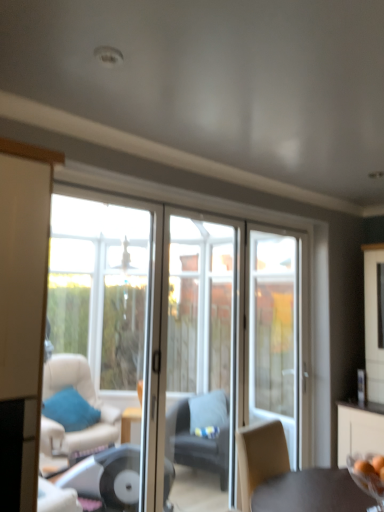
Question: Is the position of white glass door at center more distant than that of blue fabric pillow at lower left?

Choices:
 (A) no
 (B) yes

Answer: (A)

Question: Is white glass door at center to the left of blue fabric pillow at lower left from the viewer's perspective?

Choices:
 (A) no
 (B) yes

Answer: (A)

Question: From the image's perspective, is white glass door at center beneath blue fabric pillow at lower left?

Choices:
 (A) no
 (B) yes

Answer: (A)

Question: Considering the relative sizes of white glass door at center and blue fabric pillow at lower left in the image provided, is white glass door at center wider than blue fabric pillow at lower left?

Choices:
 (A) no
 (B) yes

Answer: (A)

Question: Considering the relative positions of white glass door at center and blue fabric pillow at lower left in the image provided, is white glass door at center to the right of blue fabric pillow at lower left from the viewer's perspective?

Choices:
 (A) no
 (B) yes

Answer: (B)

Question: Does point (367, 456) appear closer or farther from the camera than point (142, 357)?

Choices:
 (A) closer
 (B) farther

Answer: (B)

Question: Based on their positions, is transparent glass bowl at lower right located to the left or right of transparent glass window at left?

Choices:
 (A) left
 (B) right

Answer: (B)

Question: Considering their positions, is transparent glass bowl at lower right located in front of or behind transparent glass window at left?

Choices:
 (A) behind
 (B) front

Answer: (B)

Question: From a real-world perspective, is transparent glass bowl at lower right above or below transparent glass window at left?

Choices:
 (A) below
 (B) above

Answer: (A)

Question: Is transparent glass window at left wider or thinner than clear glass door at center, the second screen door in the left-to-right sequence?

Choices:
 (A) thin
 (B) wide

Answer: (A)

Question: In the image, is transparent glass window at left on the left side or the right side of clear glass door at center, which is the first screen door in right-to-left order?

Choices:
 (A) left
 (B) right

Answer: (A)

Question: Is point (77, 333) positioned closer to the camera than point (264, 378)?

Choices:
 (A) closer
 (B) farther

Answer: (B)

Question: Considering the positions of transparent glass window at left and clear glass door at center, the second screen door in the left-to-right sequence, in the image, is transparent glass window at left taller or shorter than clear glass door at center, the second screen door in the left-to-right sequence,?

Choices:
 (A) tall
 (B) short

Answer: (A)

Question: From a real-world perspective, is clear glass screen door at center, marked as the second screen door in a right-to-left arrangement, positioned above or below dark gray fabric chair at center?

Choices:
 (A) below
 (B) above

Answer: (B)

Question: In terms of size, does clear glass screen door at center, which is the first screen door from left to right, appear bigger or smaller than dark gray fabric chair at center?

Choices:
 (A) big
 (B) small

Answer: (B)